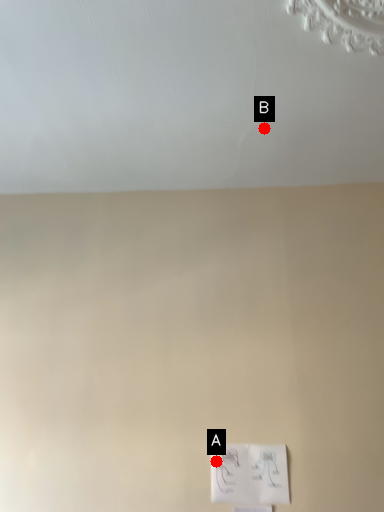
Question: Two points are circled on the image, labeled by A and B beside each circle. Which point is further to the camera?

Choices:
 (A) A is further
 (B) B is further

Answer: (B)